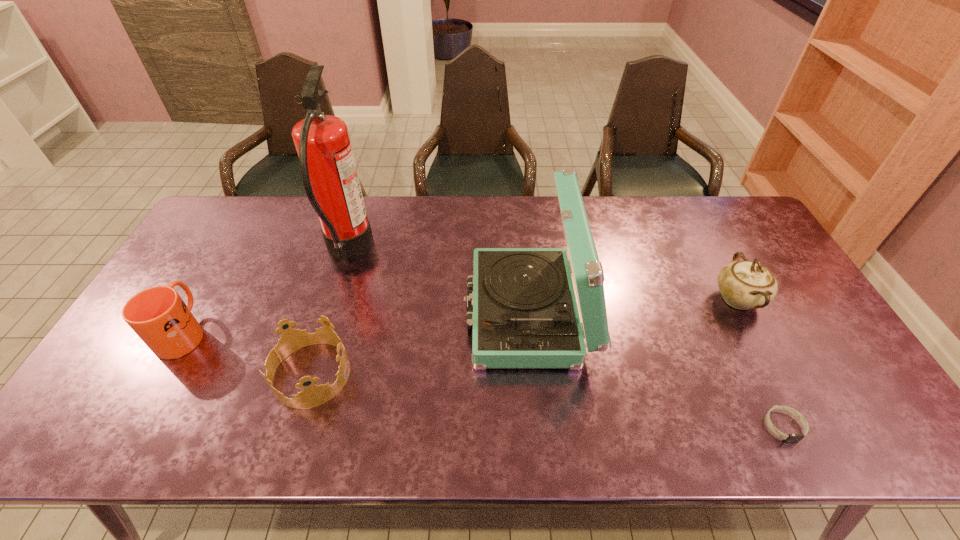
Image resolution: width=960 pixels, height=540 pixels. I want to click on blank region between the chinaware and the shortest object, so click(760, 362).

The height and width of the screenshot is (540, 960). In order to click on free space between the mug and the wristband in this screenshot , I will do `click(484, 379)`.

Locate an element on the screen. The image size is (960, 540). free space between the tiara and the nearest object is located at coordinates (547, 400).

Identify the location of free spot between the tallest object and the second shortest object. The width and height of the screenshot is (960, 540). (329, 313).

Find the location of `free point between the record player and the shortest object`. free point between the record player and the shortest object is located at coordinates (656, 369).

This screenshot has width=960, height=540. I want to click on free space between the mug and the chinaware, so click(x=461, y=315).

The height and width of the screenshot is (540, 960). I want to click on vacant area between the nearest object and the leftmost object, so click(484, 379).

I want to click on the second closest object to the leftmost object, so click(x=328, y=170).

Where is `object that is the fourth closest one to the chinaware`? This screenshot has height=540, width=960. object that is the fourth closest one to the chinaware is located at coordinates (328, 170).

The image size is (960, 540). I want to click on free spot that satisfies the following two spatial constraints: 1. on the front-facing side of the tallest object; 2. on the left side of the chinaware, so click(334, 299).